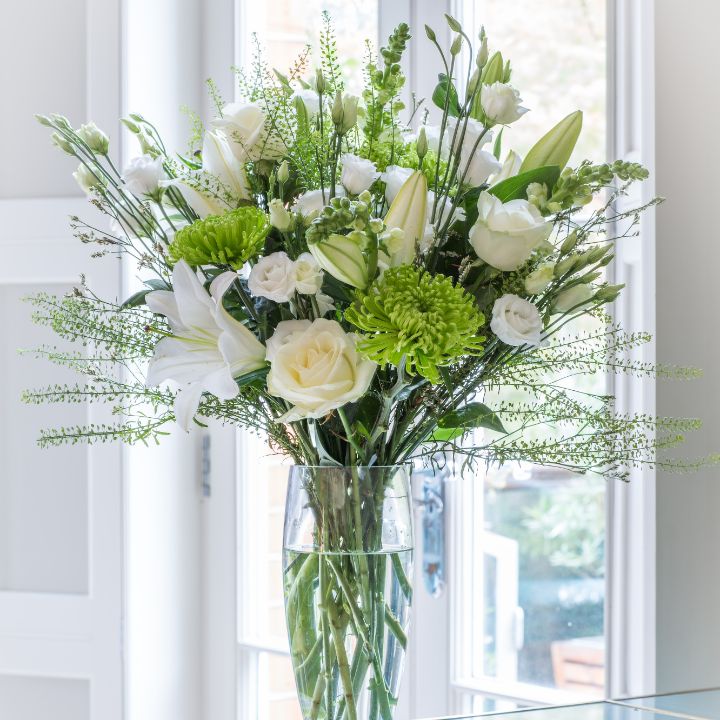
Find the location of a particular element. hinge is located at coordinates (207, 469).